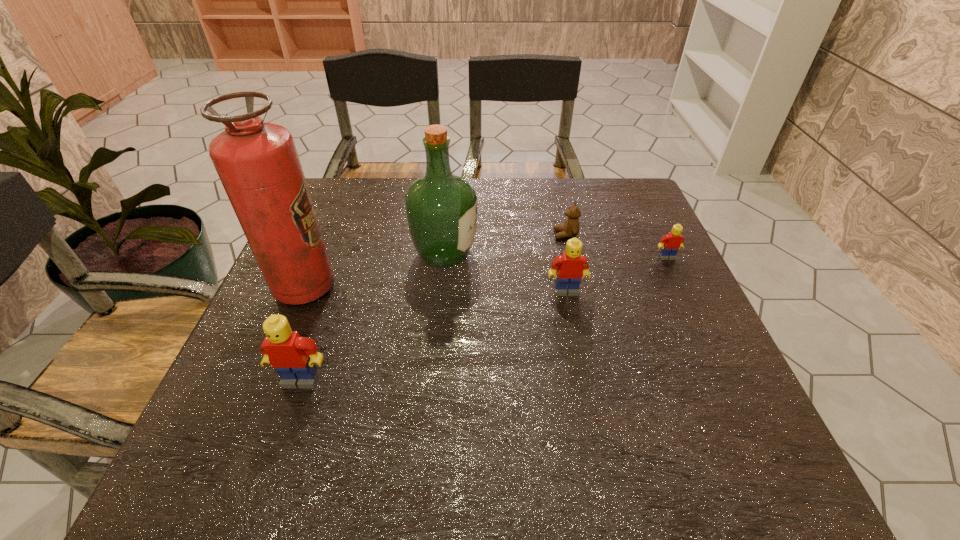
Identify the location of blank area located 0.180m on the front-facing side of the fourth tallest object. Image resolution: width=960 pixels, height=540 pixels. (580, 361).

Find the location of a particular element. The image size is (960, 540). blank space located 0.300m on the front-facing side of the rightmost Lego is located at coordinates (715, 359).

You are a GUI agent. You are given a task and a screenshot of the screen. Output one action in this format:
    pyautogui.click(x=<x>, y=<y>)
    Task: Click on the free location located 0.050m on the label side of the fire extinguisher
    The width and height of the screenshot is (960, 540).
    Given the screenshot: What is the action you would take?
    pyautogui.click(x=356, y=287)

What are the coordinates of `free space located 0.320m on the front-facing side of the second tallest object` in the screenshot? It's located at pyautogui.click(x=604, y=254).

What are the coordinates of `vacant space located 0.150m on the front-facing side of the teddy bear` in the screenshot? It's located at (497, 234).

Where is `free location located on the front-facing side of the teddy bear`? This screenshot has height=540, width=960. free location located on the front-facing side of the teddy bear is located at coordinates (509, 234).

At what (x,y) coordinates should I click in order to perform the action: click on vacant area located on the front-facing side of the teddy bear. Please return your answer as a coordinate pair (x, y). This screenshot has width=960, height=540. Looking at the image, I should click on (531, 234).

Find the location of a particular element. The width and height of the screenshot is (960, 540). object located in the near edge section of the desktop is located at coordinates (293, 357).

The width and height of the screenshot is (960, 540). Find the location of `Lego at the left edge`. Lego at the left edge is located at coordinates (293, 357).

The height and width of the screenshot is (540, 960). What are the coordinates of `fire extinguisher present at the left edge` in the screenshot? It's located at (257, 162).